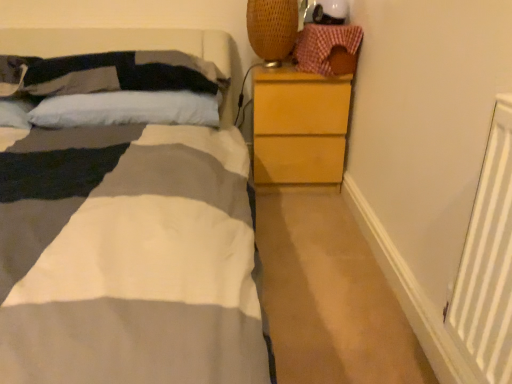
At what (x,y) coordinates should I click in order to perform the action: click on vacant region in front of light brown wooden chest of drawers at right. Please return your answer as a coordinate pair (x, y). Looking at the image, I should click on (303, 213).